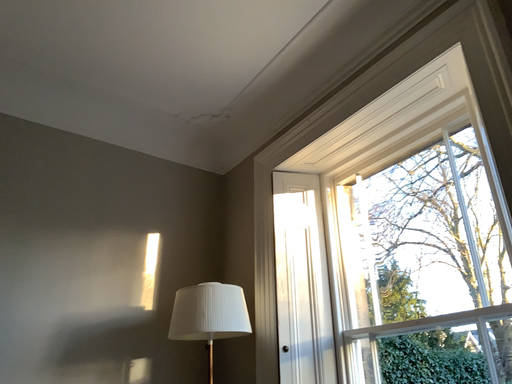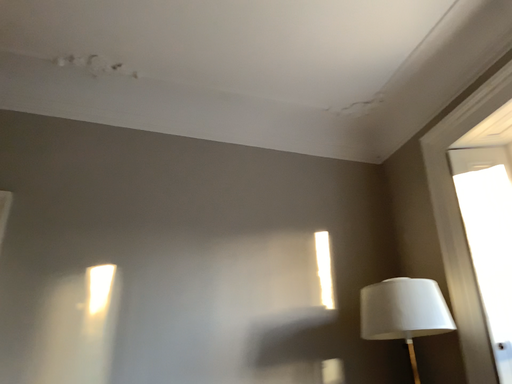
Question: Which way did the camera rotate in the video?

Choices:
 (A) rotated right
 (B) rotated left

Answer: (B)